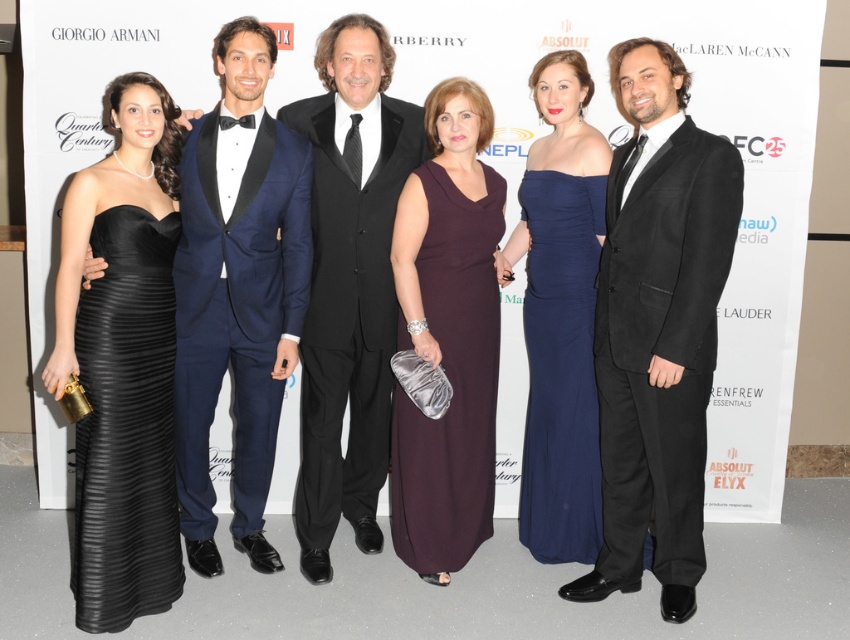
You are a photographer at the event and need to adjust the lighting for a closeup shot. The navy blue tuxedo at center and navy satin dress at center are both in your frame. Which of the two requires more space in the frame to accommodate its width?

The navy blue tuxedo at center requires more space in the frame because its width is larger than the navy satin dress at center.

You are a photographer at the event and want to focus your camera on the point at coordinates point (238,291). According to the scene description, which object will be in focus at that point?

The point (238,291) is on navy blue tuxedo at center, so focusing the camera there will put the navy blue tuxedo at center in focus.